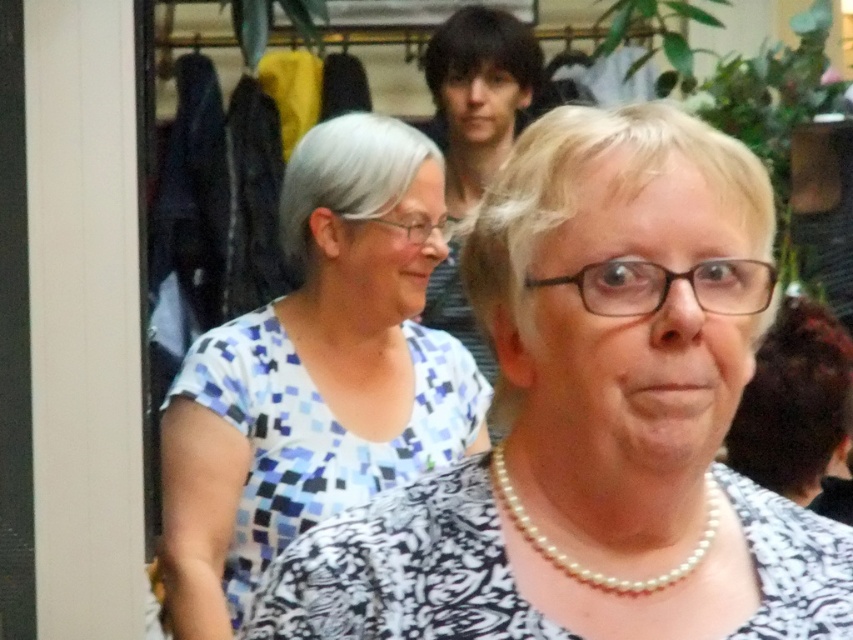
Question: Which of the following is the closest to the observer?

Choices:
 (A) (511, 509)
 (B) (318, 317)

Answer: (A)

Question: Does white printed blouse at center appear under blue mosaic shirt at center?

Choices:
 (A) yes
 (B) no

Answer: (A)

Question: Can you confirm if white printed blouse at center is positioned above pearl necklace at center?

Choices:
 (A) yes
 (B) no

Answer: (B)

Question: Which object is closer to the camera taking this photo?

Choices:
 (A) white printed blouse at center
 (B) pearl necklace at center

Answer: (A)

Question: Does white printed blouse at center have a greater width compared to pearl necklace at center?

Choices:
 (A) no
 (B) yes

Answer: (B)

Question: Among these points, which one is farthest from the camera?

Choices:
 (A) (316, 484)
 (B) (592, 262)
 (C) (531, 531)

Answer: (A)